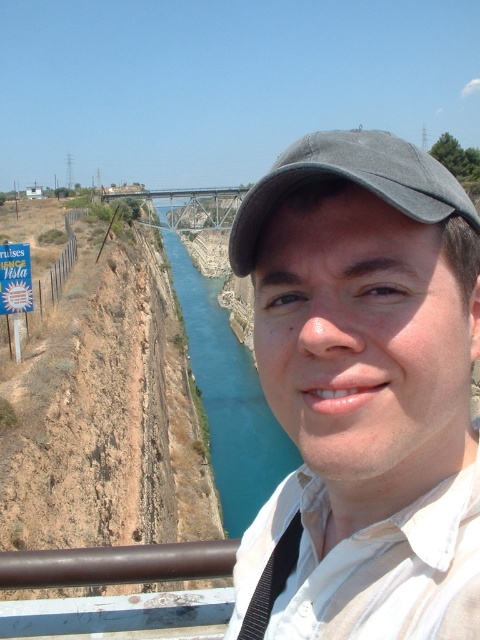
Is gray fabric cap at center positioned at the back of blue paper sign at upper left?

No, it is in front of blue paper sign at upper left.

Where is `gray fabric cap at center`? This screenshot has width=480, height=640. gray fabric cap at center is located at coordinates (352, 180).

Who is more distant from viewer, (272, 522) or (22, 250)?

Positioned behind is point (22, 250).

Is point (387, 621) positioned behind point (3, 273)?

No, (387, 621) is closer to viewer.

Locate an element on the screen. This screenshot has width=480, height=640. white cotton shirt at center is located at coordinates (370, 566).

Which is behind, point (236, 381) or point (24, 289)?

Positioned behind is point (236, 381).

What do you see at coordinates (228, 397) in the screenshot? The width and height of the screenshot is (480, 640). I see `blue water at center` at bounding box center [228, 397].

Between point (272, 460) and point (9, 248), which one is positioned in front?

Point (9, 248) is in front.

The height and width of the screenshot is (640, 480). I want to click on blue water at center, so click(228, 397).